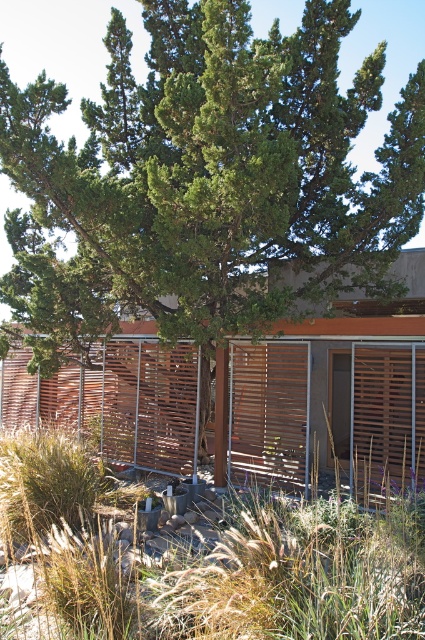
Does dry grass at center have a greater height compared to wooden slats at center?

Correct, dry grass at center is much taller as wooden slats at center.

Can you confirm if dry grass at center is positioned above wooden slats at center?

No, dry grass at center is not above wooden slats at center.

This screenshot has height=640, width=425. What do you see at coordinates (295, 576) in the screenshot?
I see `dry grass at center` at bounding box center [295, 576].

The image size is (425, 640). Identify the location of dry grass at center. (295, 576).